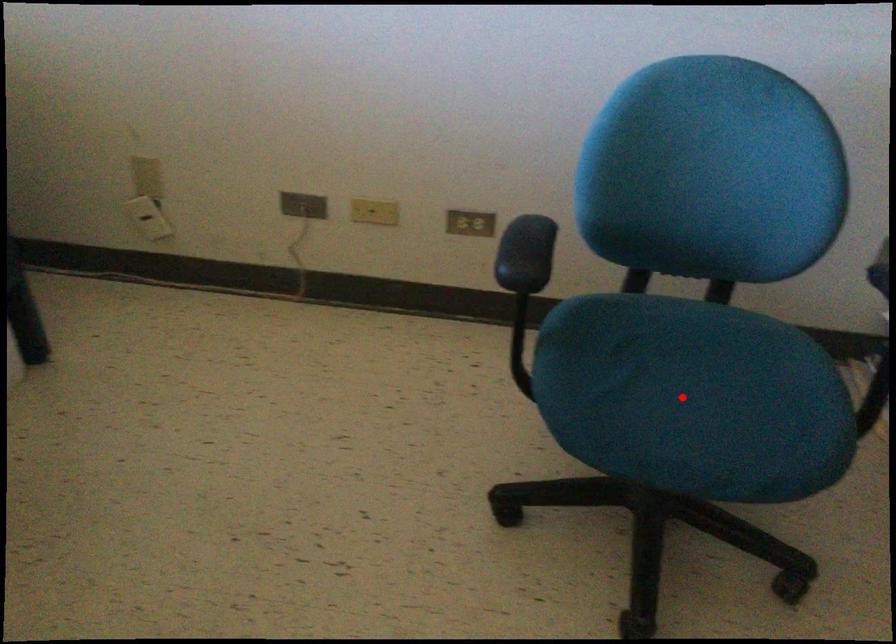
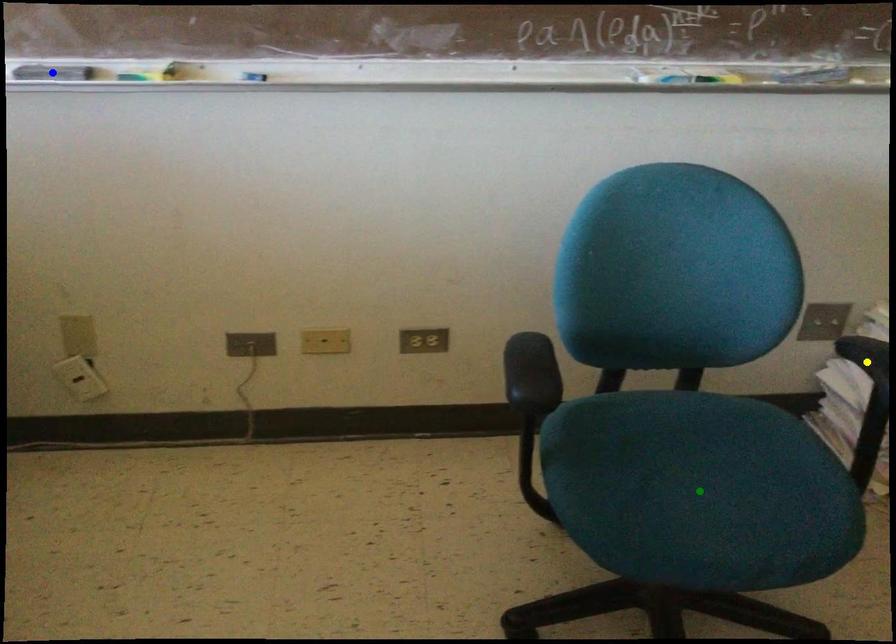
Question: I am providing you with two images of the same scene from different viewpoints. A red point is marked on the first image. You are given multiple points on the second image. Can you choose the point in image 2 that corresponds to the point in image 1?

Choices:
 (A) yellow point
 (B) green point
 (C) blue point

Answer: (B)